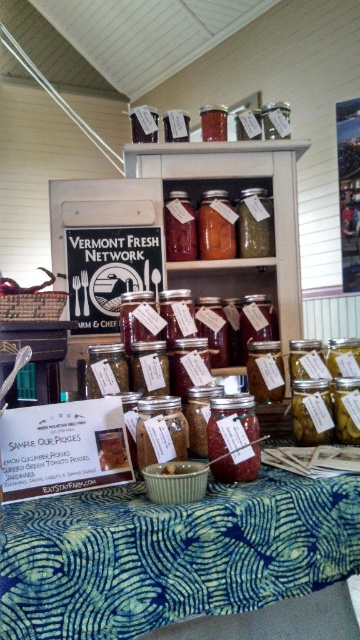
You are standing at the farm stand and see two points marked on the jars. The first point is at coordinate [169,564] and the second is at [245,438]. Which point is closer to you?

Point [169,564] is in front of point [245,438], so it is closer to you.

You are setting up a display for a craft fair and have a blue printed fabric at lower center and a translucent glass jar at center. Which item should you place first if you want to arrange items from largest to smallest?

The blue printed fabric at lower center should be placed first because it is larger than the translucent glass jar at center.

You are setting up a display at a market stall and need to ensure that the translucent glass jar at center is visible to customers. Since the blue printed fabric at lower center is underneath it, will the jar be clearly visible from above?

The blue printed fabric at lower center is positioned under the translucent glass jar at center, so yes, the jar will be clearly visible from above as the fabric is beneath it.